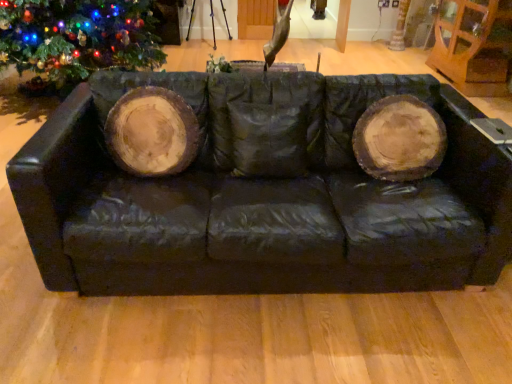
This screenshot has height=384, width=512. What are the coordinates of `vacant area to the left of brown wood tree trunk at upper right` in the screenshot? It's located at (378, 52).